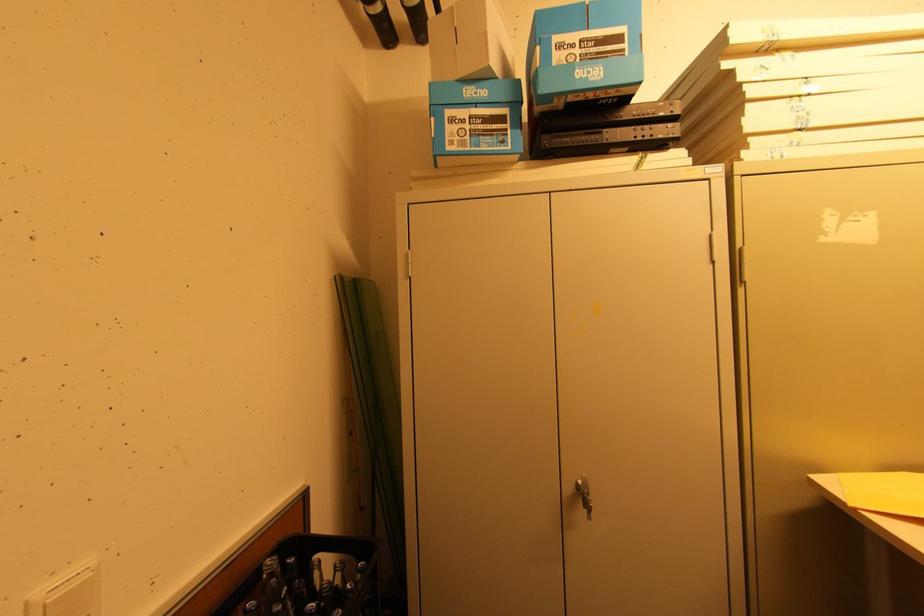
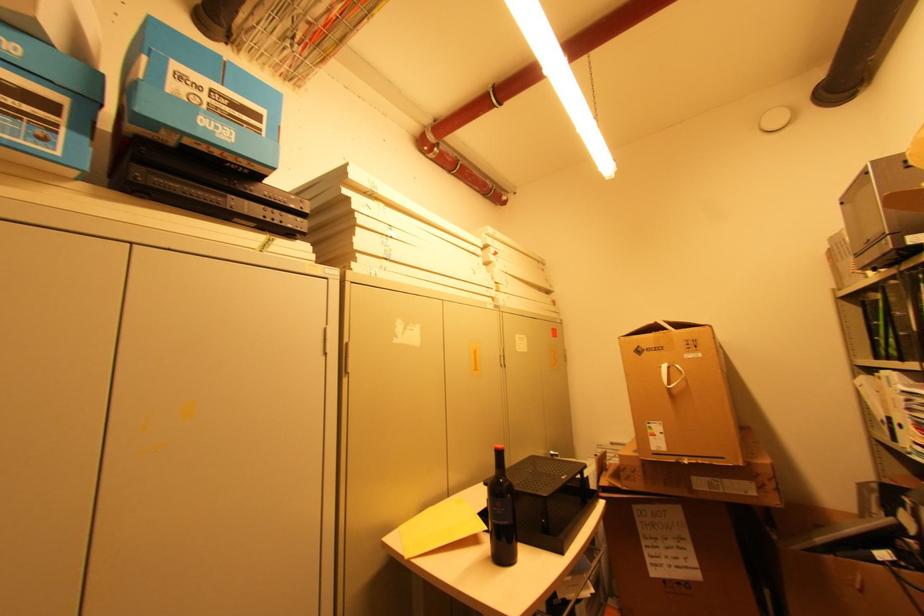
Where in the second image is the point corresponding to [630,150] from the first image?

(258, 225)